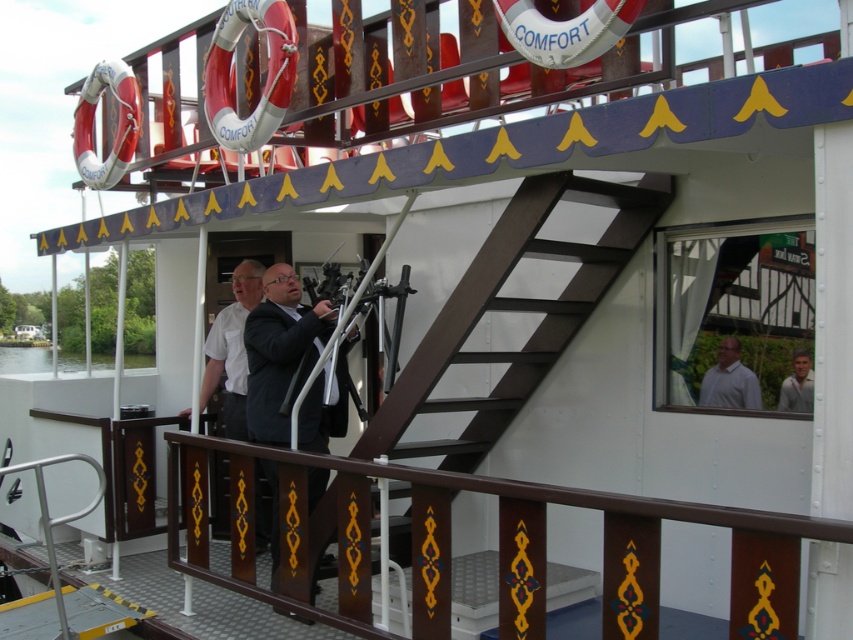
You are a passenger on the boat named Comfort and you want to find the dark gray suit at center. According to the deck layout, where would you look for it?

The dark gray suit at center is located at the coordinates point (x=280, y=349) on the deck layout.

You are a photographer on the boat deck. You need to capture a photo of both the dark gray suit at center and the light brown leather jacket at upper right. Which clothing item has a wider silhouette in the photo?

The dark gray suit at center has a wider silhouette than the light brown leather jacket at upper right because its width surpasses the latter.